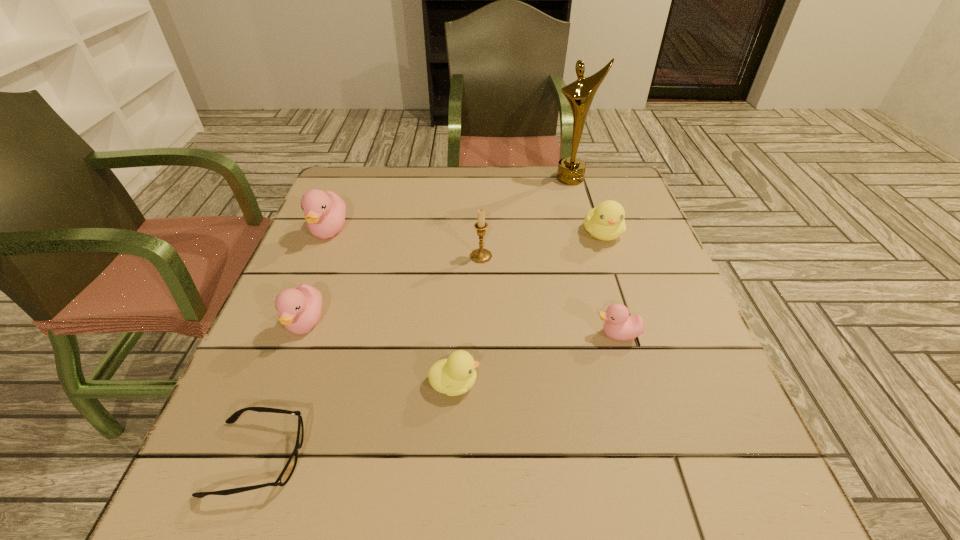
In the image, there is a desktop. At what (x,y) coordinates should I click in order to perform the action: click on free region at the near edge. Please return your answer as a coordinate pair (x, y). Looking at the image, I should click on click(x=608, y=500).

In order to click on vacant space at the left edge of the desktop in this screenshot , I will do `click(367, 232)`.

In the image, there is a desktop. At what (x,y) coordinates should I click in order to perform the action: click on vacant space at the right edge. Please return your answer as a coordinate pair (x, y). Looking at the image, I should click on (648, 322).

At what (x,y) coordinates should I click in order to perform the action: click on vacant space at the far right corner. Please return your answer as a coordinate pair (x, y). The width and height of the screenshot is (960, 540). Looking at the image, I should click on (607, 179).

In the image, there is a desktop. What are the coordinates of `vacant space at the near right corner` in the screenshot? It's located at (660, 469).

This screenshot has width=960, height=540. Find the location of `free space between the second biggest pink duckling and the smallest pink duckling`. free space between the second biggest pink duckling and the smallest pink duckling is located at coordinates (462, 329).

This screenshot has width=960, height=540. What are the coordinates of `empty space that is in between the nearest object and the farthest pink duckling` in the screenshot? It's located at (294, 345).

Locate an element on the screen. This screenshot has height=540, width=960. free space between the smallest pink duckling and the bigger yellow duckling is located at coordinates (610, 284).

Where is `empty space between the second smallest pink duckling and the right yellow duckling`? empty space between the second smallest pink duckling and the right yellow duckling is located at coordinates (454, 279).

Locate an element on the screen. Image resolution: width=960 pixels, height=540 pixels. empty location between the spectacles and the farthest pink duckling is located at coordinates (294, 345).